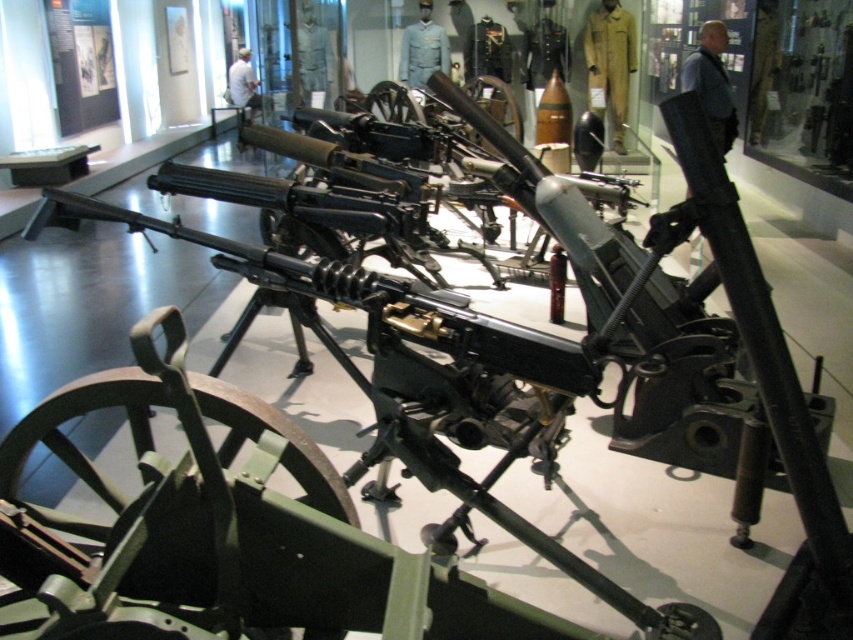
Is khaki fabric uniform at center thinner than light blue fabric uniform at center?

No.

Between point (624, 77) and point (415, 74), which one is positioned behind?

The point (624, 77) is more distant.

Identify the location of khaki fabric uniform at center. (610, 64).

Can you confirm if light blue fabric uniform at center is positioned to the left of white shirt at center?

No, light blue fabric uniform at center is not to the left of white shirt at center.

Who is shorter, light blue fabric uniform at center or white shirt at center?

With less height is white shirt at center.

Between point (421, 88) and point (231, 83), which one is positioned in front?

Positioned in front is point (421, 88).

I want to click on light blue fabric uniform at center, so click(422, 51).

Is khaki fabric uniform at center closer to camera compared to white shirt at center?

Yes, it is.

Who is lower down, khaki fabric uniform at center or white shirt at center?

khaki fabric uniform at center is lower down.

Identify the location of khaki fabric uniform at center. (610, 64).

The image size is (853, 640). Find the location of `khaki fabric uniform at center`. khaki fabric uniform at center is located at coordinates (610, 64).